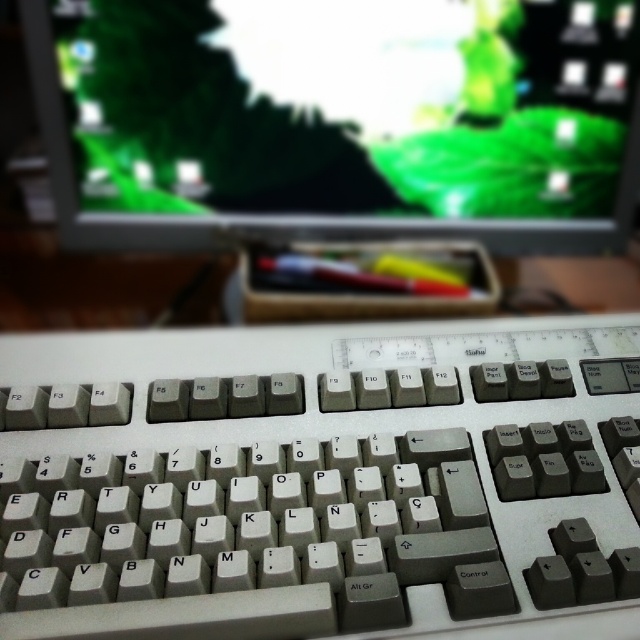
You are trying to determine the distance between two points on the keyboard. The first point is labeled as point (477, 385) and the second is point (296, 40). Based on the scene description, which point is nearer to you?

Point (477, 385) is closer to the viewer than point (296, 40).

Based on the photo, you are setting up a new desk and need to place the white plastic keyboard at center and the matte plastic monitor at upper center. Given their sizes, which object should you place first to ensure they fit properly on the desk?

The white plastic keyboard at center is larger in size than the matte plastic monitor at upper center, so you should place the white plastic keyboard at center first to accommodate its larger size before positioning the smaller matte plastic monitor at upper center.